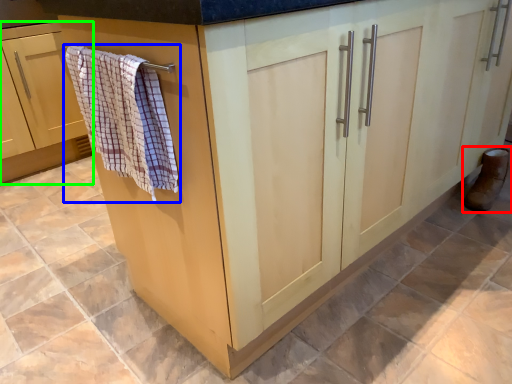
Question: Which object is positioned closest to footwear (highlighted by a red box)? Select from bath towel (highlighted by a blue box) and cabinetry (highlighted by a green box).

Choices:
 (A) bath towel
 (B) cabinetry

Answer: (A)